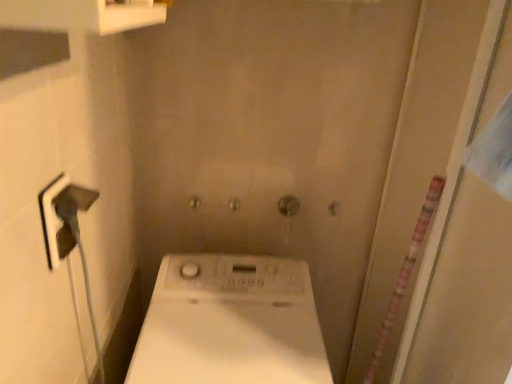
Question: Is transparent plastic screen door at right situated inside white matte washing machine at center or outside?

Choices:
 (A) outside
 (B) inside

Answer: (A)

Question: Visually, is transparent plastic screen door at right positioned to the left or to the right of white matte washing machine at center?

Choices:
 (A) left
 (B) right

Answer: (B)

Question: From a real-world perspective, is transparent plastic screen door at right above or below white matte washing machine at center?

Choices:
 (A) below
 (B) above

Answer: (B)

Question: From the image's perspective, is white matte washing machine at center above or below transparent plastic screen door at right?

Choices:
 (A) above
 (B) below

Answer: (B)

Question: In terms of height, does white matte washing machine at center look taller or shorter compared to transparent plastic screen door at right?

Choices:
 (A) short
 (B) tall

Answer: (A)

Question: Based on their sizes in the image, would you say white matte washing machine at center is bigger or smaller than transparent plastic screen door at right?

Choices:
 (A) big
 (B) small

Answer: (B)

Question: From a real-world perspective, relative to transparent plastic screen door at right, is white matte washing machine at center vertically above or below?

Choices:
 (A) below
 (B) above

Answer: (A)